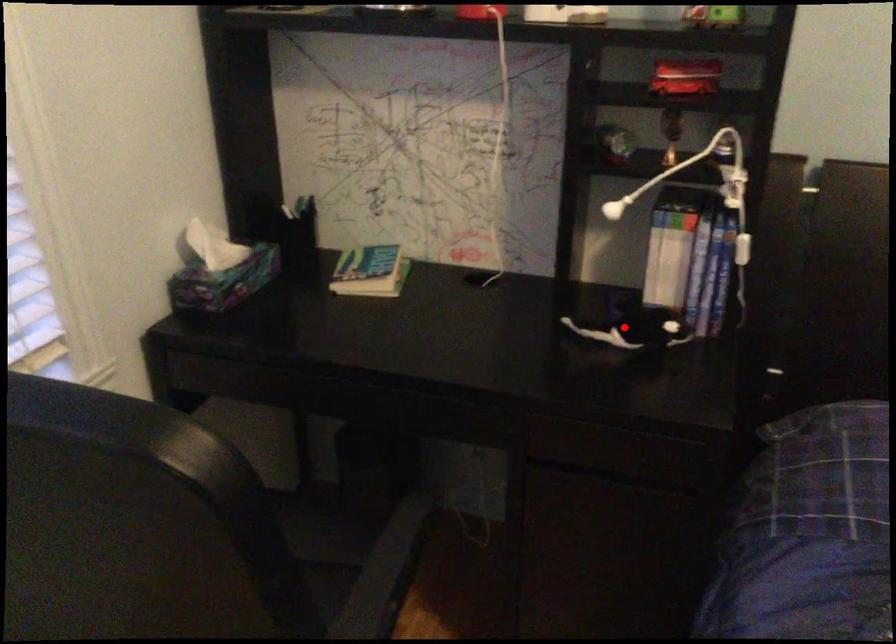
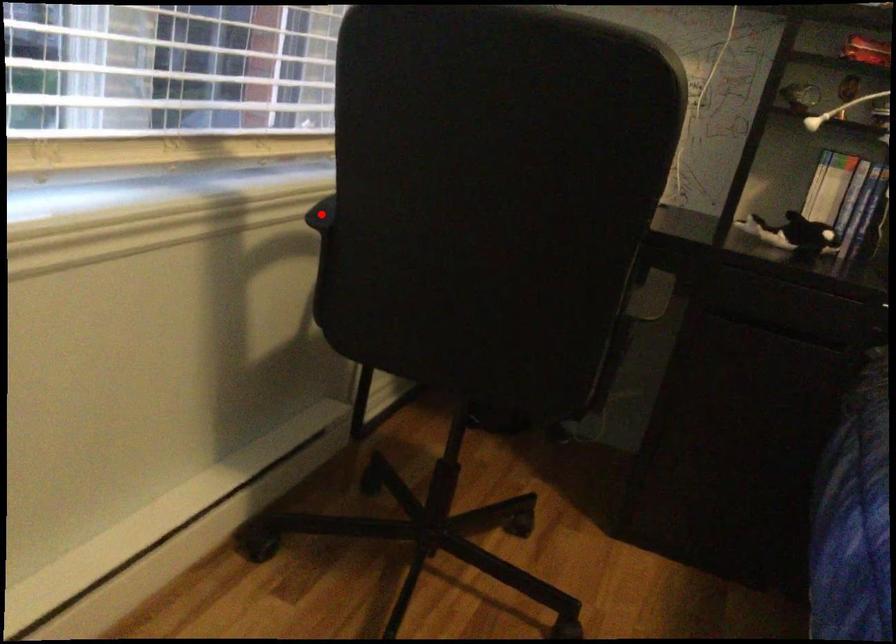
I am providing you with two images of the same scene from different viewpoints. A red point is marked on the first image and another point is marked on the second image. Is the marked point in image1 the same physical position as the marked point in image2?

No